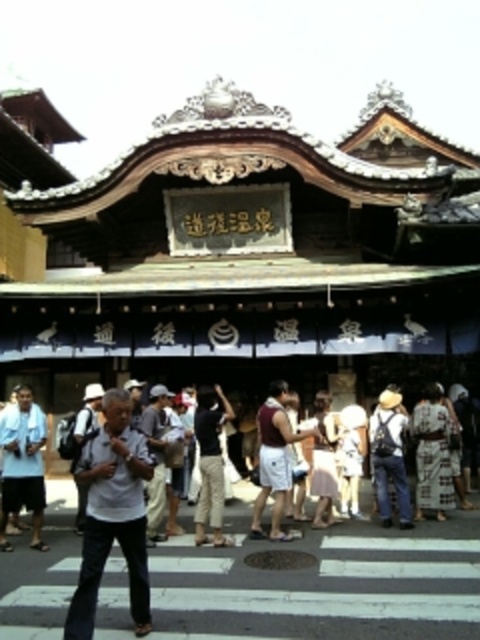
Question: Which object appears farthest from the camera in this image?

Choices:
 (A) white cotton kimono at center
 (B) white towel at left
 (C) white matte backpack at center
 (D) maroon fabric shirt at center

Answer: (A)

Question: Does maroon fabric shirt at center have a lesser width compared to denim jeans at center?

Choices:
 (A) yes
 (B) no

Answer: (B)

Question: Does white towel at left appear on the left side of dark gray cotton pants at center?

Choices:
 (A) no
 (B) yes

Answer: (B)

Question: Which point appears farthest from the camera in this image?

Choices:
 (A) (428, 448)
 (B) (315, 515)
 (C) (202, 456)

Answer: (A)

Question: Which point is farther to the camera?

Choices:
 (A) white towel at left
 (B) white cotton kimono at center
 (C) dark gray cotton pants at center
 (D) denim jeans at center

Answer: (B)

Question: Can you confirm if pink fabric dress at center is thinner than white matte backpack at center?

Choices:
 (A) yes
 (B) no

Answer: (A)